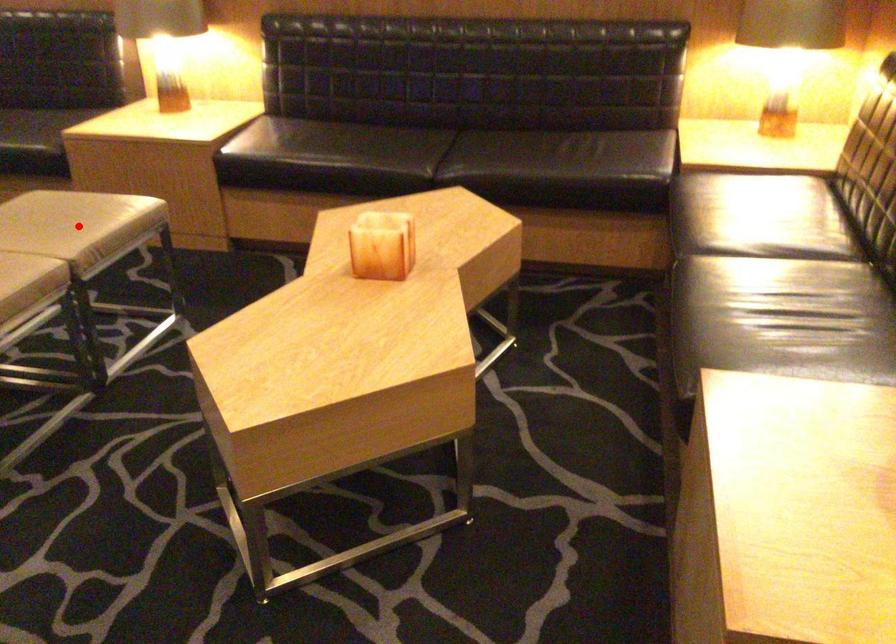
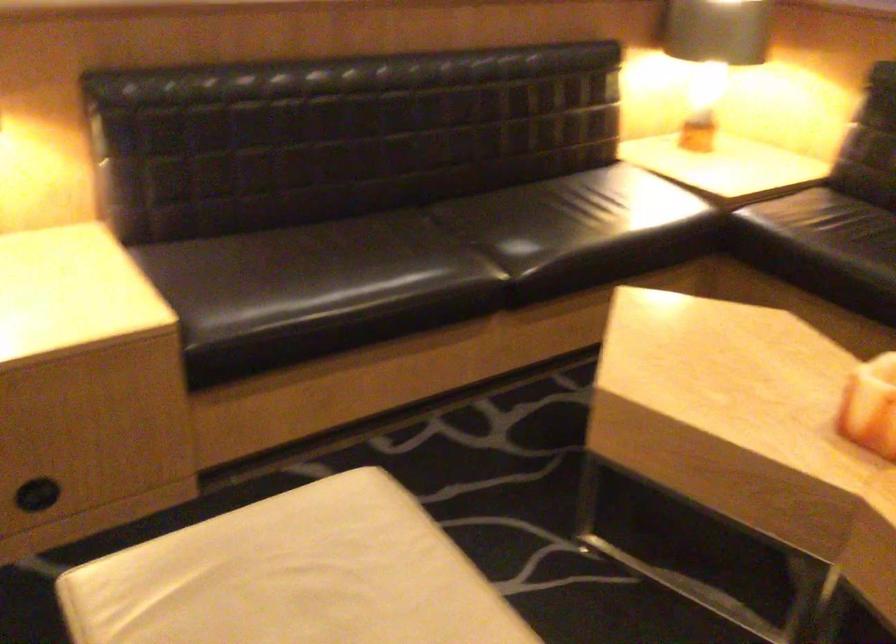
Question: I am providing you with two images of the same scene from different viewpoints. A red point is marked on the first image. Is the red point's position out of view in image 2?

Choices:
 (A) Yes
 (B) No

Answer: (A)